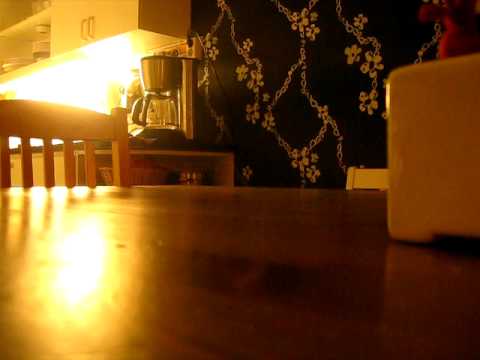
At what (x,y) coordinates should I click in order to perform the action: click on door. Please return your answer as a coordinate pair (x, y). This screenshot has height=360, width=480. Looking at the image, I should click on (115, 15).